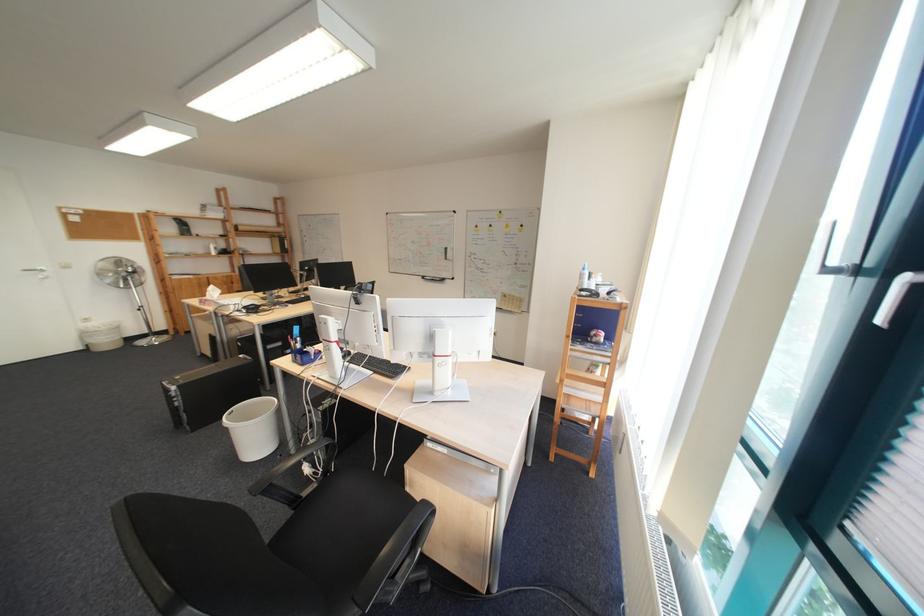
Describe the element at coordinates (298, 462) in the screenshot. I see `the black chair armrest` at that location.